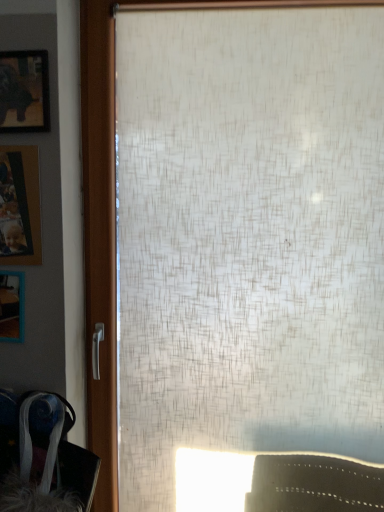
Question: From the image's perspective, is velvet-like fabric swivel chair at lower left located above or below wooden photo frame at left, which is the second picture frame in bottom-to-top order?

Choices:
 (A) below
 (B) above

Answer: (A)

Question: Is point (84, 471) positioned closer to the camera than point (18, 166)?

Choices:
 (A) closer
 (B) farther

Answer: (A)

Question: Considering the real-world distances, which object is farthest from the matte black picture frame at upper left, positioned as the third picture frame in bottom-to-top order?

Choices:
 (A) wooden photo frame at left, which is the second picture frame in bottom-to-top order
 (B) velvet-like fabric swivel chair at lower left
 (C) wooden frame at left, positioned as the third picture frame in top-to-bottom order

Answer: (B)

Question: Which of these objects is positioned farthest from the wooden frame at left, which is counted as the 1th picture frame, starting from the bottom?

Choices:
 (A) wooden photo frame at left, placed as the 2th picture frame when sorted from top to bottom
 (B) matte black picture frame at upper left, which ranks as the 1th picture frame in top-to-bottom order
 (C) velvet-like fabric swivel chair at lower left

Answer: (B)